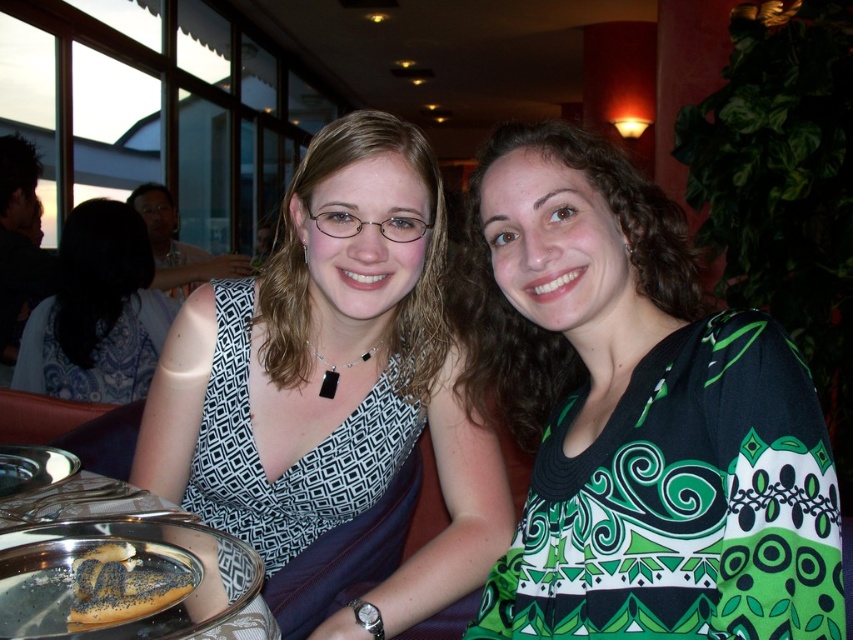
You are a photographer setting up for a photoshoot. You need to position a light to the left of the black matte dress at center so it doesn not cast a shadow on the black printed fabric dress at center. Where should you place the light?

Place the light to the left of the black matte dress at center. Since the black printed fabric dress at center is to the right of the black matte dress at center, the light will illuminate the area without casting a shadow on the dress to its right.

You are standing at the center of the image and want to reach the brown poppy seed bagel at lower left located at point (120, 588). Which direction should you move to get there?

You should move towards the lower left direction to reach the brown poppy seed bagel at lower left located at point (120, 588).

You are a fashion designer observing two dresses displayed on a table in a store. The green printed dress at center and the black matte dress at center are both placed in the same area. Based on their positions, which dress is shorter?

The green printed dress at center is shorter than the black matte dress at center according to the description provided.